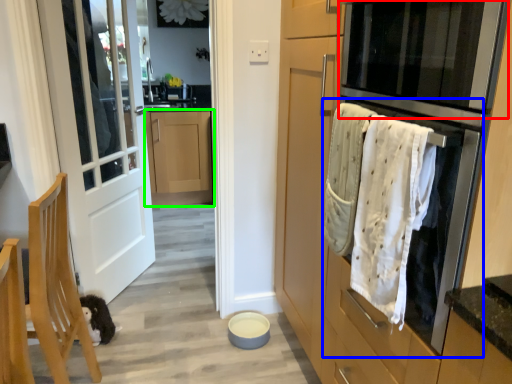
Question: Considering the real-world distances, which object is closest to oven (highlighted by a red box)? oven (highlighted by a blue box) or cabinetry (highlighted by a green box).

Choices:
 (A) oven
 (B) cabinetry

Answer: (A)